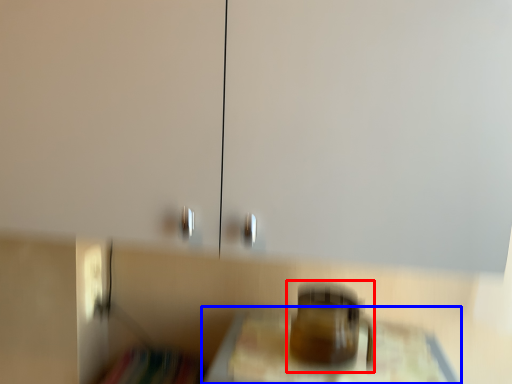
Question: Which point is further to the camera, appliance (highlighted by a red box) or furniture (highlighted by a blue box)?

Choices:
 (A) appliance
 (B) furniture

Answer: (A)